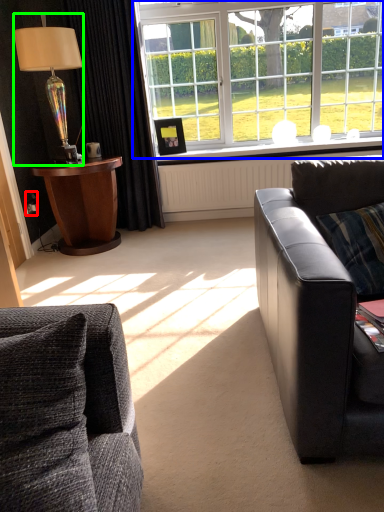
Question: Which object is positioned closest to power outlet (highlighted by a red box)? Select from window (highlighted by a blue box) and lamp (highlighted by a green box).

Choices:
 (A) window
 (B) lamp

Answer: (B)